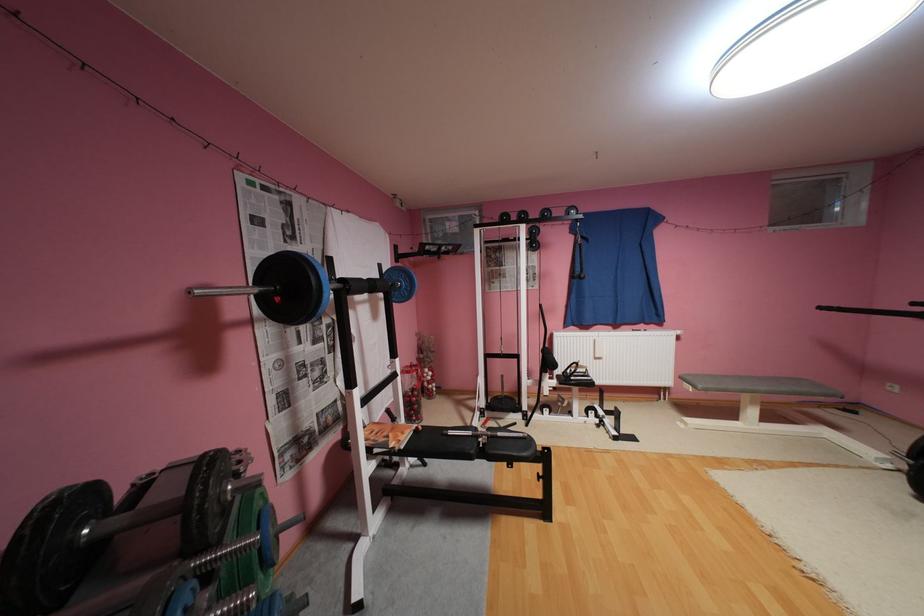
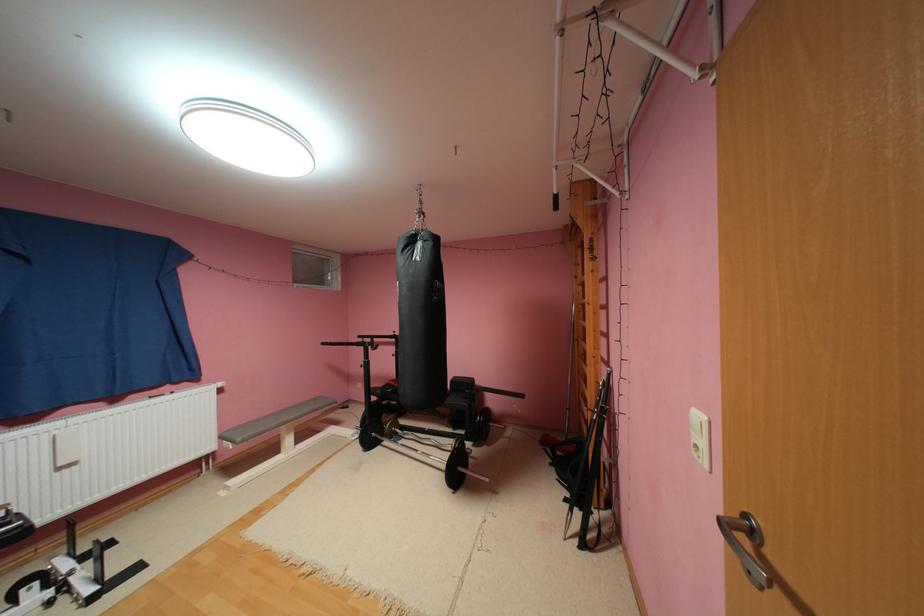
Question: The camera is either moving clockwise (left) or counter-clockwise (right) around the object. The first image is from the beginning of the video and the second image is from the end. Is the camera moving left or right when shooting the video?

Choices:
 (A) Left
 (B) Right

Answer: (A)